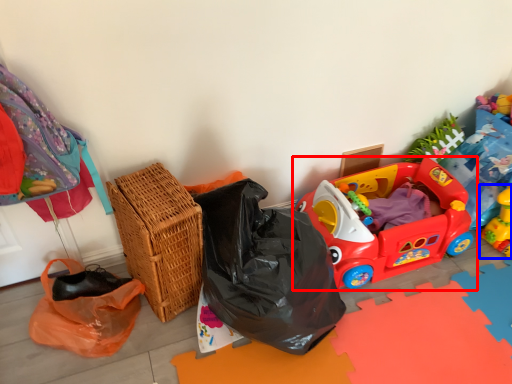
Question: Among these objects, which one is farthest to the camera, toy (highlighted by a red box) or toy (highlighted by a blue box)?

Choices:
 (A) toy
 (B) toy

Answer: (B)